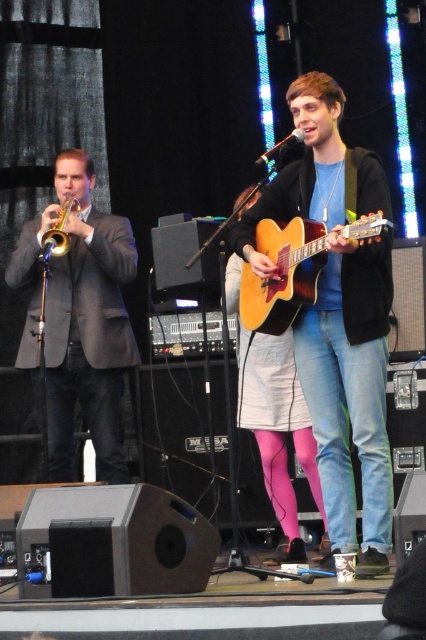
Between point (331, 321) and point (98, 284), which one is positioned in front?

Positioned in front is point (331, 321).

Is matte black guitar at center above matte black suit at left?

No, matte black guitar at center is not above matte black suit at left.

Locate an element on the screen. Image resolution: width=426 pixels, height=640 pixels. matte black guitar at center is located at coordinates (339, 316).

Between point (351, 429) and point (69, 211), which one is positioned in front?

Point (351, 429)

Does blue jeans at center have a larger size compared to brass shiny trumpet at left?

Indeed, blue jeans at center has a larger size compared to brass shiny trumpet at left.

At what (x,y) coordinates should I click in order to perform the action: click on blue jeans at center. Please return your answer as a coordinate pair (x, y). The height and width of the screenshot is (640, 426). Looking at the image, I should click on 347,426.

Is matte black guitar at center positioned in front of blue jeans at center?

Yes, it is in front of blue jeans at center.

The width and height of the screenshot is (426, 640). Find the location of `matte black guitar at center`. matte black guitar at center is located at coordinates (339, 316).